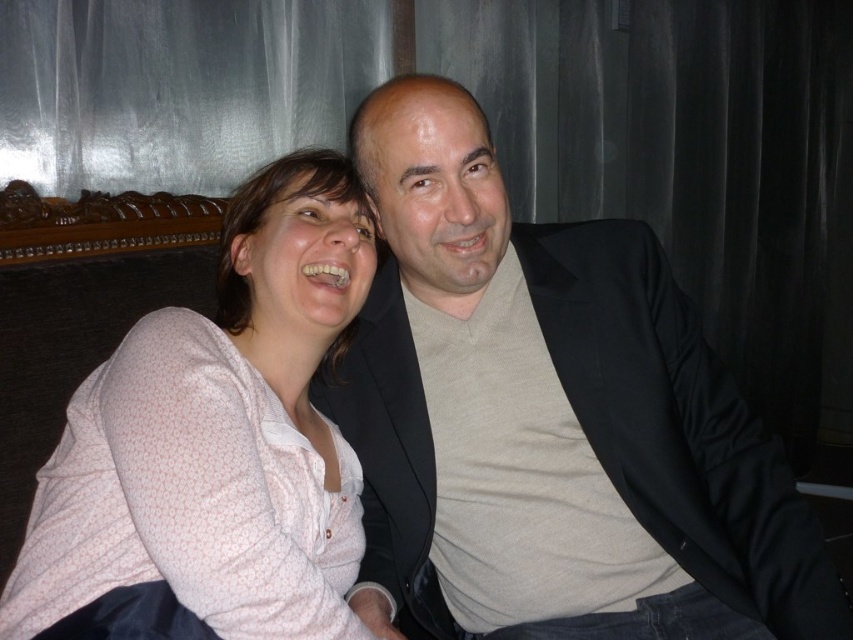
You are designing a new clothing line and need to know the relative sizes of the items in the image. Which object is wider, the matte black suit at center or the white dotted shirt at upper left?

The matte black suit at center is wider than the white dotted shirt at upper left according to the description.

You are a photographer setting up for a group photo. You notice the matte black suit at center and the white dotted shirt at upper left in the scene. Based on their positions, which clothing item is positioned to the right side of the other?

The matte black suit at center is to the right of the white dotted shirt at upper left.